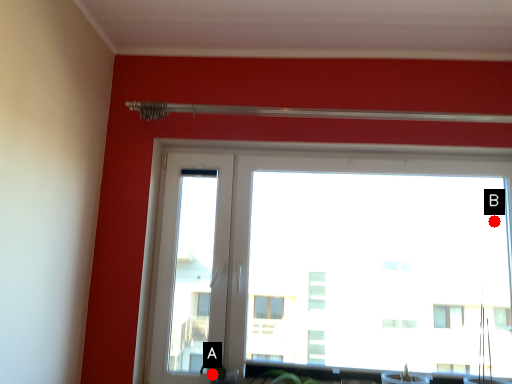
Question: Two points are circled on the image, labeled by A and B beside each circle. Which point appears closest to the camera in this image?

Choices:
 (A) A is closer
 (B) B is closer

Answer: (A)